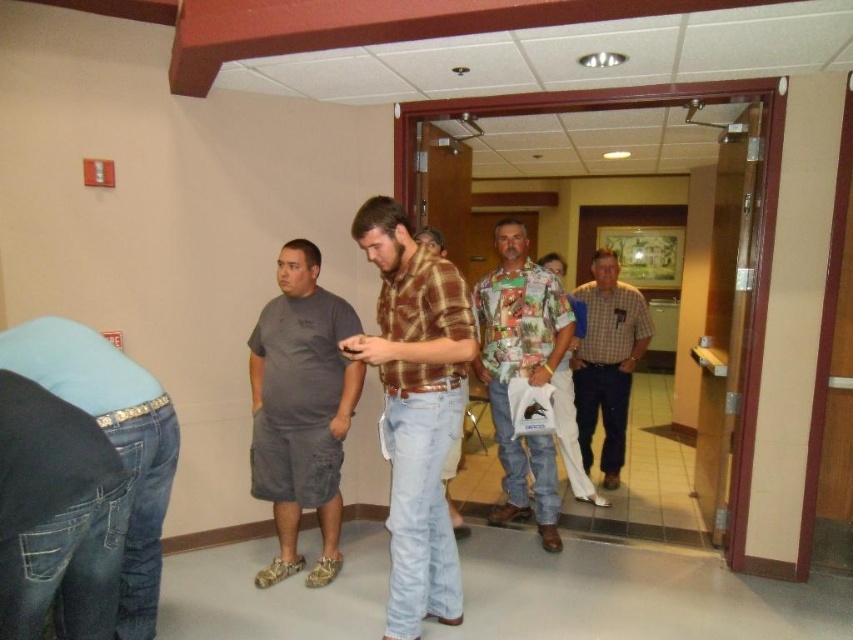
This screenshot has height=640, width=853. Identify the location of brown plaid shirt at center. (415, 410).

Between brown plaid shirt at center and checkered fabric shirt at center, which one is positioned higher?

checkered fabric shirt at center is higher up.

Which is behind, point (399, 392) or point (602, 260)?

The point (602, 260) is more distant.

This screenshot has width=853, height=640. I want to click on brown plaid shirt at center, so click(x=415, y=410).

Who is lower down, checkered fabric shirt at center or floral shirt at center?

checkered fabric shirt at center is below.

Is point (573, 397) less distant than point (569, 374)?

No, (573, 397) is behind (569, 374).

Which is behind, point (619, 406) or point (572, 460)?

The point (619, 406) is more distant.

Where is `checkered fabric shirt at center`? This screenshot has width=853, height=640. checkered fabric shirt at center is located at coordinates (607, 362).

Does brown plaid shirt at center come behind printed fabric shirt at center?

No, it is not.

Does brown plaid shirt at center have a larger size compared to printed fabric shirt at center?

Actually, brown plaid shirt at center might be smaller than printed fabric shirt at center.

Locate an element on the screen. brown plaid shirt at center is located at coordinates (415, 410).